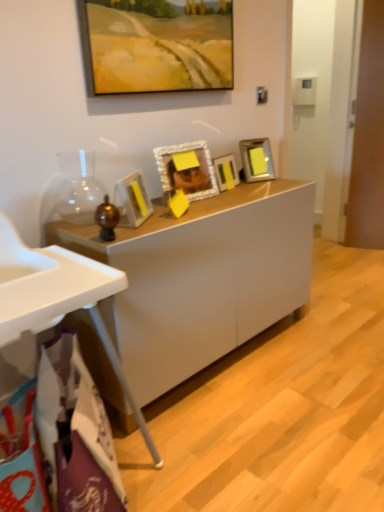
In order to click on free location to the right of white glossy cabinet at center in this screenshot , I will do `click(322, 346)`.